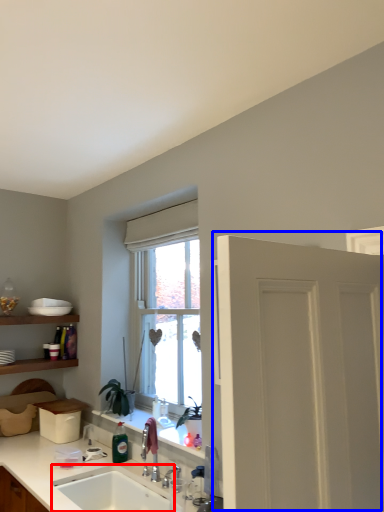
Question: Among these objects, which one is farthest to the camera, sink (highlighted by a red box) or door (highlighted by a blue box)?

Choices:
 (A) sink
 (B) door

Answer: (A)